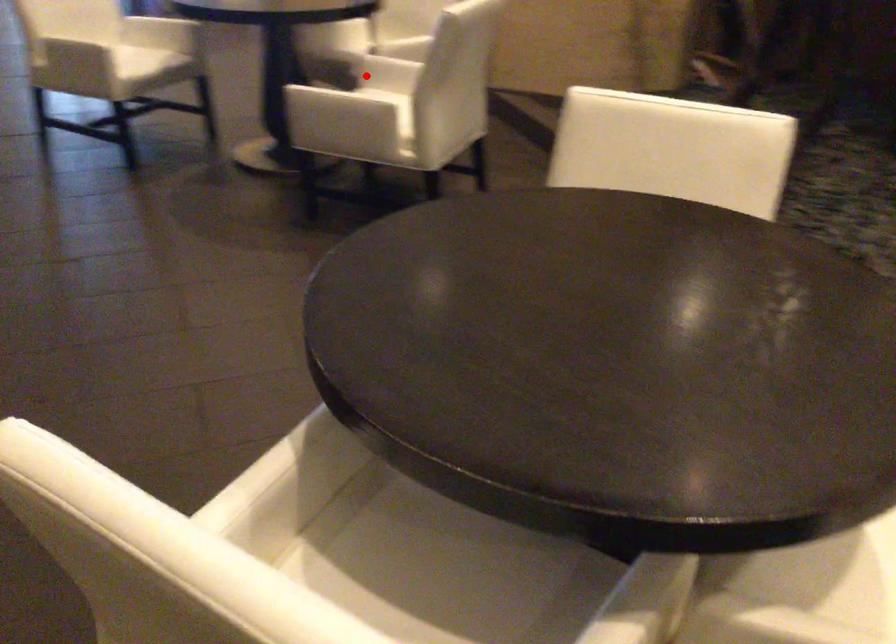
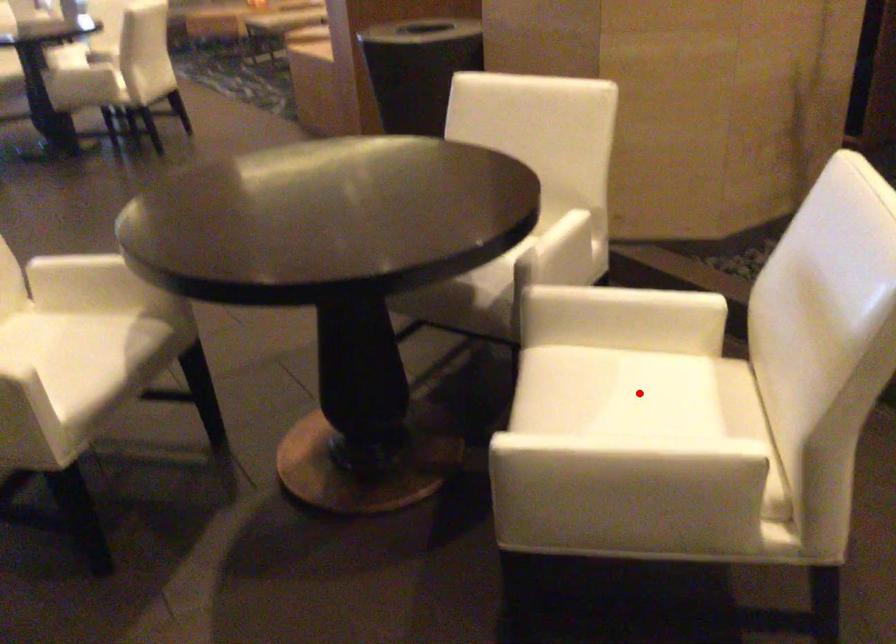
I am providing you with two images of the same scene from different viewpoints. A red point is marked on the first image and another point is marked on the second image. Is the marked point in image1 the same physical position as the marked point in image2?

Yes